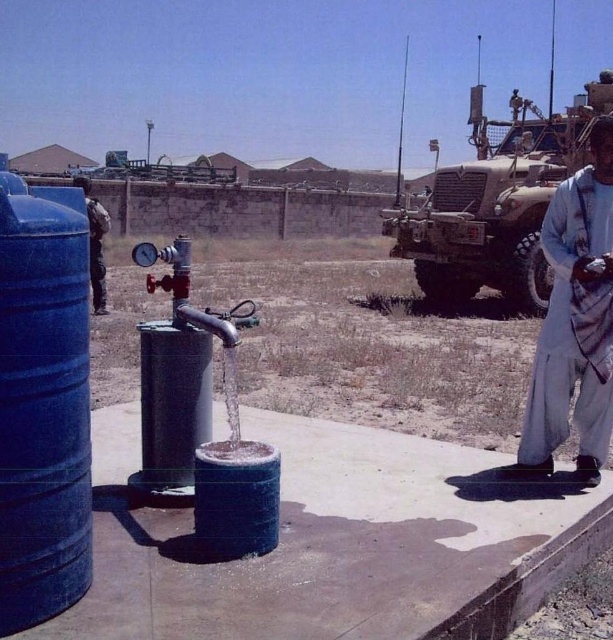
Is camouflage fabric military vehicle at upper right wider than light gray cotton pants at right?

Yes, camouflage fabric military vehicle at upper right is wider than light gray cotton pants at right.

Locate an element on the screen. This screenshot has height=640, width=613. camouflage fabric military vehicle at upper right is located at coordinates (497, 204).

Find the location of a particular element. camouflage fabric military vehicle at upper right is located at coordinates (497, 204).

Is blue matte barrel at left above camouflage fabric military vehicle at upper right?

Actually, blue matte barrel at left is below camouflage fabric military vehicle at upper right.

Is blue matte barrel at left wider than camouflage fabric military vehicle at upper right?

In fact, blue matte barrel at left might be narrower than camouflage fabric military vehicle at upper right.

Is point (1, 236) positioned in front of point (408, 250)?

Yes, point (1, 236) is in front of point (408, 250).

Identify the location of blue matte barrel at left. (44, 403).

Can you confirm if blue matte barrel at left is bigger than light gray cotton pants at right?

Actually, blue matte barrel at left might be smaller than light gray cotton pants at right.

Image resolution: width=613 pixels, height=640 pixels. Describe the element at coordinates (44, 403) in the screenshot. I see `blue matte barrel at left` at that location.

At what (x,y) coordinates should I click in order to perform the action: click on blue matte barrel at left. Please return your answer as a coordinate pair (x, y). The width and height of the screenshot is (613, 640). Looking at the image, I should click on (x=44, y=403).